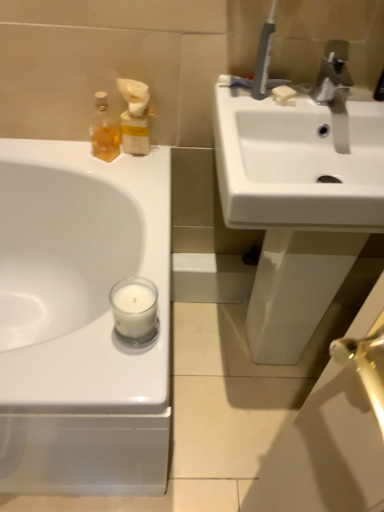
Question: Does translucent glass bottle at upper left have a lesser width compared to white matte glass candle at lower center?

Choices:
 (A) yes
 (B) no

Answer: (A)

Question: From the image's perspective, is translucent glass bottle at upper left beneath white matte glass candle at lower center?

Choices:
 (A) no
 (B) yes

Answer: (A)

Question: From a real-world perspective, is translucent glass bottle at upper left physically below white matte glass candle at lower center?

Choices:
 (A) no
 (B) yes

Answer: (A)

Question: Can we say translucent glass bottle at upper left lies outside white matte glass candle at lower center?

Choices:
 (A) yes
 (B) no

Answer: (A)

Question: Considering the relative positions of translucent glass bottle at upper left and white matte glass candle at lower center in the image provided, is translucent glass bottle at upper left to the left of white matte glass candle at lower center from the viewer's perspective?

Choices:
 (A) no
 (B) yes

Answer: (B)

Question: Choose the correct answer: Is silver metallic faucet at upper right inside white glossy sink at upper right, the 1th sink when ordered from right to left, or outside it?

Choices:
 (A) inside
 (B) outside

Answer: (B)

Question: Considering the positions of silver metallic faucet at upper right and white glossy sink at upper right, which is the second sink in left-to-right order, in the image, is silver metallic faucet at upper right wider or thinner than white glossy sink at upper right, which is the second sink in left-to-right order,?

Choices:
 (A) thin
 (B) wide

Answer: (A)

Question: Considering the positions of silver metallic faucet at upper right and white glossy sink at upper right, which is the second sink in left-to-right order, in the image, is silver metallic faucet at upper right bigger or smaller than white glossy sink at upper right, which is the second sink in left-to-right order,?

Choices:
 (A) small
 (B) big

Answer: (A)

Question: Is point (324, 77) closer or farther from the camera than point (362, 100)?

Choices:
 (A) closer
 (B) farther

Answer: (B)

Question: Would you say translucent glass bottle at upper left is to the left or to the right of silver metallic faucet at upper right in the picture?

Choices:
 (A) right
 (B) left

Answer: (B)

Question: Looking at the image, does translucent glass bottle at upper left seem bigger or smaller compared to silver metallic faucet at upper right?

Choices:
 (A) big
 (B) small

Answer: (B)

Question: In the image, is translucent glass bottle at upper left positioned in front of or behind silver metallic faucet at upper right?

Choices:
 (A) front
 (B) behind

Answer: (B)

Question: From the image's perspective, is translucent glass bottle at upper left located above or below silver metallic faucet at upper right?

Choices:
 (A) below
 (B) above

Answer: (A)

Question: Is point 92,145 closer or farther from the camera than point 276,95?

Choices:
 (A) farther
 (B) closer

Answer: (A)

Question: Is translucent glass bottle at upper left taller or shorter than white matte soap at upper right?

Choices:
 (A) tall
 (B) short

Answer: (A)